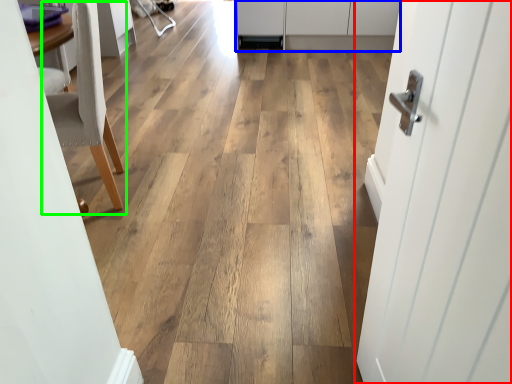
Question: Based on their relative distances, which object is nearer to door (highlighted by a red box)? Choose from cabinetry (highlighted by a blue box) and chair (highlighted by a green box).

Choices:
 (A) cabinetry
 (B) chair

Answer: (B)